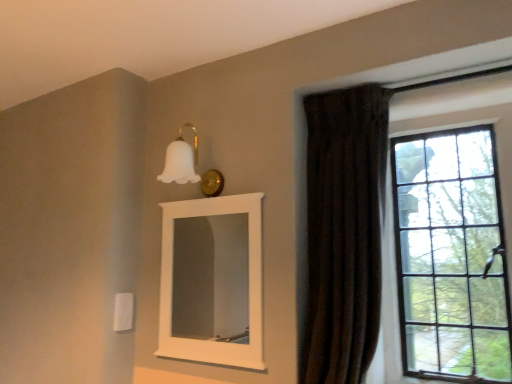
The image size is (512, 384). Identify the location of clear glass window at right. (451, 256).

Find the location of a particular element. white matte mirror at upper center is located at coordinates (210, 277).

Find the location of a particular element. The height and width of the screenshot is (384, 512). brown velvet curtain at right is located at coordinates (343, 232).

Consider the image. Which of these two, white matte mirror at upper center or clear glass window at right, is bigger?

clear glass window at right is bigger.

Consider the image. Considering the sizes of objects white matte mirror at upper center and clear glass window at right in the image provided, who is wider, white matte mirror at upper center or clear glass window at right?

Wider between the two is clear glass window at right.

Is point (195, 264) positioned before point (402, 149)?

No, (195, 264) is further to viewer.

Based on the photo, is brown velvet curtain at right taller than white matte glass sconce at upper center?

Correct, brown velvet curtain at right is much taller as white matte glass sconce at upper center.

Which is more to the right, brown velvet curtain at right or white matte glass sconce at upper center?

brown velvet curtain at right.

Considering the positions of objects brown velvet curtain at right and white matte glass sconce at upper center in the image provided, who is behind, brown velvet curtain at right or white matte glass sconce at upper center?

white matte glass sconce at upper center is more distant.

This screenshot has height=384, width=512. Find the location of `curtain in front of the white matte glass sconce at upper center`. curtain in front of the white matte glass sconce at upper center is located at coordinates (343, 232).

Is the depth of white matte mirror at upper center greater than that of brown velvet curtain at right?

That is True.

From the image's perspective, which object appears higher, white matte mirror at upper center or brown velvet curtain at right?

brown velvet curtain at right.

Which object is positioned more to the left, white matte mirror at upper center or brown velvet curtain at right?

From the viewer's perspective, white matte mirror at upper center appears more on the left side.

Is white matte mirror at upper center oriented away from brown velvet curtain at right?

That's not correct — white matte mirror at upper center is not looking away from brown velvet curtain at right.

Is point (318, 151) in front of point (207, 291)?

Yes, it is.

How different are the orientations of brown velvet curtain at right and white matte mirror at upper center in degrees?

brown velvet curtain at right and white matte mirror at upper center are facing 2.19 degrees away from each other.

You are a GUI agent. You are given a task and a screenshot of the screen. Output one action in this format:
    pyautogui.click(x=<x>, y=<y>)
    Task: Click on the mirror that appears below the brown velvet curtain at right (from a real-world perspective)
    
    Given the screenshot: What is the action you would take?
    pyautogui.click(x=210, y=277)

Between brown velvet curtain at right and white matte mirror at upper center, which one has smaller size?

With smaller size is white matte mirror at upper center.

Does white matte glass sconce at upper center contain clear glass window at right?

No, clear glass window at right is not inside white matte glass sconce at upper center.

Considering the relative sizes of white matte glass sconce at upper center and clear glass window at right in the image provided, is white matte glass sconce at upper center taller than clear glass window at right?

Incorrect, the height of white matte glass sconce at upper center is not larger of that of clear glass window at right.

Would you say white matte glass sconce at upper center is to the left or to the right of clear glass window at right in the picture?

white matte glass sconce at upper center is positioned on clear glass window at right's left side.

Between point (190, 146) and point (418, 206), which one is positioned in front?

The point (190, 146) is closer.

Is clear glass window at right wider or thinner than brown velvet curtain at right?

In the image, clear glass window at right appears to be more narrow than brown velvet curtain at right.

Is clear glass window at right not near brown velvet curtain at right?

clear glass window at right is actually quite close to brown velvet curtain at right.

Considering their positions, is clear glass window at right located in front of or behind brown velvet curtain at right?

clear glass window at right is behind brown velvet curtain at right.

Based on the photo, is clear glass window at right far from white matte glass sconce at upper center?

No, clear glass window at right is in close proximity to white matte glass sconce at upper center.

How many degrees apart are the facing directions of clear glass window at right and white matte glass sconce at upper center?

They differ by 0.87 degrees in their facing directions.

Which of these two, clear glass window at right or white matte glass sconce at upper center, is bigger?

clear glass window at right is bigger.

Is clear glass window at right at the left side of white matte glass sconce at upper center?

No.

You are a GUI agent. You are given a task and a screenshot of the screen. Output one action in this format:
    pyautogui.click(x=<x>, y=<y>)
    Task: Click on the window located above the white matte mirror at upper center (from a real-world perspective)
    
    Given the screenshot: What is the action you would take?
    pyautogui.click(x=451, y=256)

Where is `light fixture that appears behind the brown velvet curtain at right`? The image size is (512, 384). light fixture that appears behind the brown velvet curtain at right is located at coordinates (189, 166).

Considering their positions, is clear glass window at right positioned further to brown velvet curtain at right than white matte glass sconce at upper center?

white matte glass sconce at upper center.

From the image, which object appears to be nearer to white matte glass sconce at upper center, white matte mirror at upper center or clear glass window at right?

The object closer to white matte glass sconce at upper center is clear glass window at right.

Based on their spatial positions, is clear glass window at right or brown velvet curtain at right closer to white matte mirror at upper center?

brown velvet curtain at right is closer to white matte mirror at upper center.

From the image, which object appears to be farther from white matte mirror at upper center, brown velvet curtain at right or clear glass window at right?

Among the two, clear glass window at right is located further to white matte mirror at upper center.

When comparing their distances from white matte glass sconce at upper center, does brown velvet curtain at right or clear glass window at right seem closer?

brown velvet curtain at right lies closer to white matte glass sconce at upper center than the other object.

Looking at the image, which one is located closer to brown velvet curtain at right, white matte glass sconce at upper center or clear glass window at right?

Based on the image, clear glass window at right appears to be nearer to brown velvet curtain at right.

Looking at the image, which one is located closer to white matte mirror at upper center, white matte glass sconce at upper center or brown velvet curtain at right?

white matte glass sconce at upper center.

Considering their positions, is clear glass window at right positioned closer to white matte glass sconce at upper center than brown velvet curtain at right?

brown velvet curtain at right lies closer to white matte glass sconce at upper center than the other object.

Locate an element on the screen. Image resolution: width=512 pixels, height=384 pixels. mirror between white matte glass sconce at upper center and brown velvet curtain at right in the horizontal direction is located at coordinates (210, 277).

You are a GUI agent. You are given a task and a screenshot of the screen. Output one action in this format:
    pyautogui.click(x=<x>, y=<y>)
    Task: Click on the mirror between white matte glass sconce at upper center and clear glass window at right from left to right
    
    Given the screenshot: What is the action you would take?
    pyautogui.click(x=210, y=277)

The height and width of the screenshot is (384, 512). Find the location of `curtain located between white matte glass sconce at upper center and clear glass window at right in the left-right direction`. curtain located between white matte glass sconce at upper center and clear glass window at right in the left-right direction is located at coordinates (343, 232).

The image size is (512, 384). I want to click on curtain situated between white matte mirror at upper center and clear glass window at right from left to right, so click(343, 232).